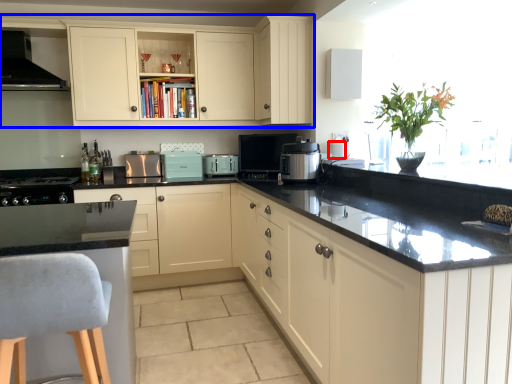
Question: Which of the following is the farthest to the observer, appliance (highlighted by a red box) or cabinetry (highlighted by a blue box)?

Choices:
 (A) appliance
 (B) cabinetry

Answer: (A)